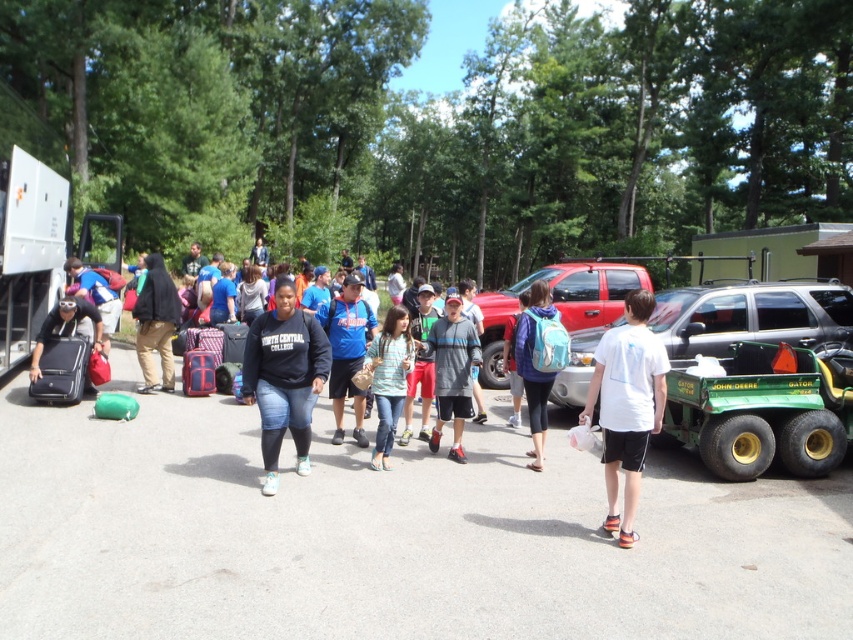
You are standing at the point with coordinates (538, 360). Looking around, you see a teal fabric backpack at center. Is there a teal fabric backpack at center?

Yes, the point (538, 360) indicates the teal fabric backpack at center.

Please provide the coordinates of the white matte shirt at center in the image. The coordinates should be in the format of a point like point (x=625, y=404). The answer should be in the format of point followed by the coordinates in parentheses. The question must mention the white matte shirt at center and the coordinates format. The answer must include the coordinates exactly as given in the Objects Description. The question should not reveal the coordinates. The answer must not explain anything beyond the

point (x=625, y=404)